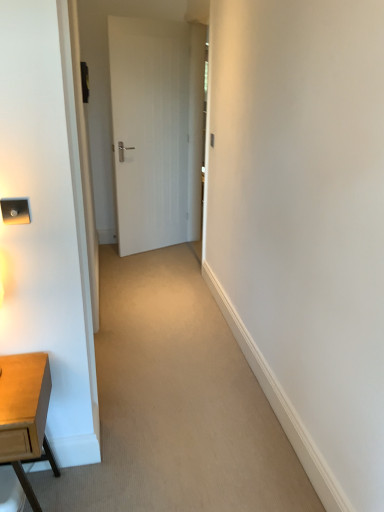
What do you see at coordinates (156, 131) in the screenshot?
I see `white wood door at center` at bounding box center [156, 131].

Locate an element on the screen. Image resolution: width=384 pixels, height=512 pixels. white wood door at center is located at coordinates (156, 131).

Image resolution: width=384 pixels, height=512 pixels. What do you see at coordinates (25, 414) in the screenshot?
I see `light brown wooden desk at lower left` at bounding box center [25, 414].

Identify the location of light brown wooden desk at lower left. (25, 414).

Where is `white wood door at center`? white wood door at center is located at coordinates (156, 131).

Visually, is light brown wooden desk at lower left positioned to the left or to the right of white wood door at center?

Based on their positions, light brown wooden desk at lower left is located to the left of white wood door at center.

Considering the positions of objects light brown wooden desk at lower left and white wood door at center in the image provided, who is behind, light brown wooden desk at lower left or white wood door at center?

white wood door at center.

Does point (11, 381) come closer to viewer compared to point (138, 34)?

Yes.

From the image's perspective, is light brown wooden desk at lower left below white wood door at center?

Yes.

From a real-world perspective, is light brown wooden desk at lower left beneath white wood door at center?

Yes, from a real-world perspective, light brown wooden desk at lower left is under white wood door at center.

Considering the sizes of light brown wooden desk at lower left and white wood door at center in the image, is light brown wooden desk at lower left wider or thinner than white wood door at center?

In the image, light brown wooden desk at lower left appears to be wider than white wood door at center.

From their relative heights in the image, would you say light brown wooden desk at lower left is taller or shorter than white wood door at center?

Clearly, light brown wooden desk at lower left is shorter compared to white wood door at center.

Considering the sizes of objects light brown wooden desk at lower left and white wood door at center in the image provided, who is smaller, light brown wooden desk at lower left or white wood door at center?

light brown wooden desk at lower left.

Is light brown wooden desk at lower left completely or partially outside of white wood door at center?

Indeed, light brown wooden desk at lower left is completely outside white wood door at center.

Are light brown wooden desk at lower left and white wood door at center beside each other?

No, light brown wooden desk at lower left is not beside white wood door at center.

Is light brown wooden desk at lower left turned away from white wood door at center?

No, light brown wooden desk at lower left is not facing the opposite direction of white wood door at center.

The height and width of the screenshot is (512, 384). In order to click on desk on the left of white wood door at center in this screenshot , I will do `click(25, 414)`.

Considering the relative positions of white wood door at center and light brown wooden desk at lower left in the image provided, is white wood door at center to the left or to the right of light brown wooden desk at lower left?

In the image, white wood door at center appears on the right side of light brown wooden desk at lower left.

Is white wood door at center in front of or behind light brown wooden desk at lower left in the image?

Clearly, white wood door at center is behind light brown wooden desk at lower left.

Does point (182, 151) come behind point (14, 369)?

Yes, point (182, 151) is farther from viewer.

From the image's perspective, is white wood door at center over light brown wooden desk at lower left?

Yes, from the image's perspective, white wood door at center is on top of light brown wooden desk at lower left.

From a real-world perspective, is white wood door at center positioned under light brown wooden desk at lower left based on gravity?

No, from a real-world perspective, white wood door at center is not under light brown wooden desk at lower left.

Is white wood door at center wider than light brown wooden desk at lower left?

Incorrect, the width of white wood door at center does not surpass that of light brown wooden desk at lower left.

Can you confirm if white wood door at center is taller than light brown wooden desk at lower left?

Correct, white wood door at center is much taller as light brown wooden desk at lower left.

Who is bigger, white wood door at center or light brown wooden desk at lower left?

white wood door at center.

Is light brown wooden desk at lower left inside white wood door at center?

Actually, light brown wooden desk at lower left is outside white wood door at center.

Is there a large distance between white wood door at center and light brown wooden desk at lower left?

That's right, there is a large distance between white wood door at center and light brown wooden desk at lower left.

Is white wood door at center facing towards light brown wooden desk at lower left?

No, white wood door at center is not aimed at light brown wooden desk at lower left.

How different are the orientations of white wood door at center and light brown wooden desk at lower left in degrees?

The angular difference between white wood door at center and light brown wooden desk at lower left is 26.2 degrees.

The height and width of the screenshot is (512, 384). I want to click on desk lying in front of the white wood door at center, so click(25, 414).

Locate an element on the screen. desk to the left of white wood door at center is located at coordinates (25, 414).

The image size is (384, 512). I want to click on desk below the white wood door at center (from a real-world perspective), so click(25, 414).